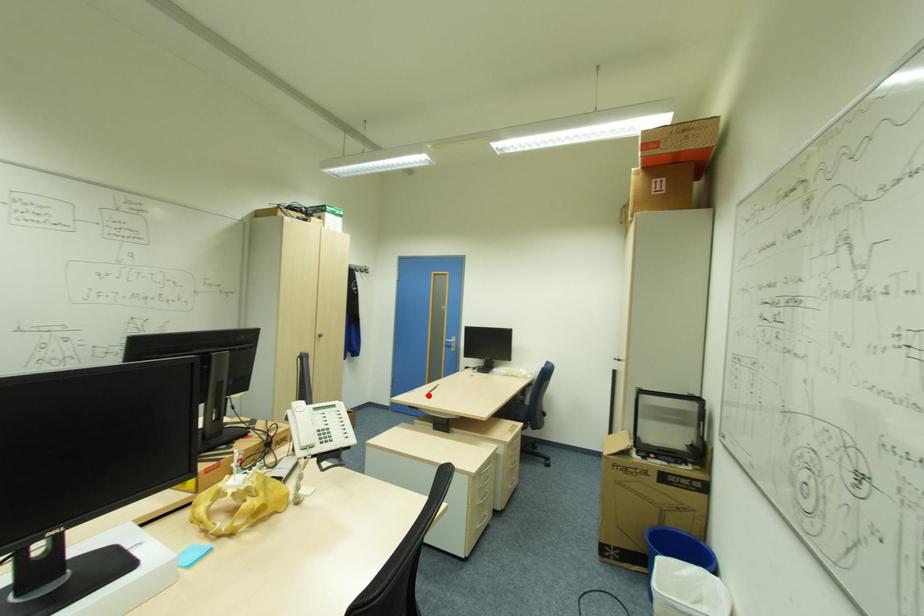
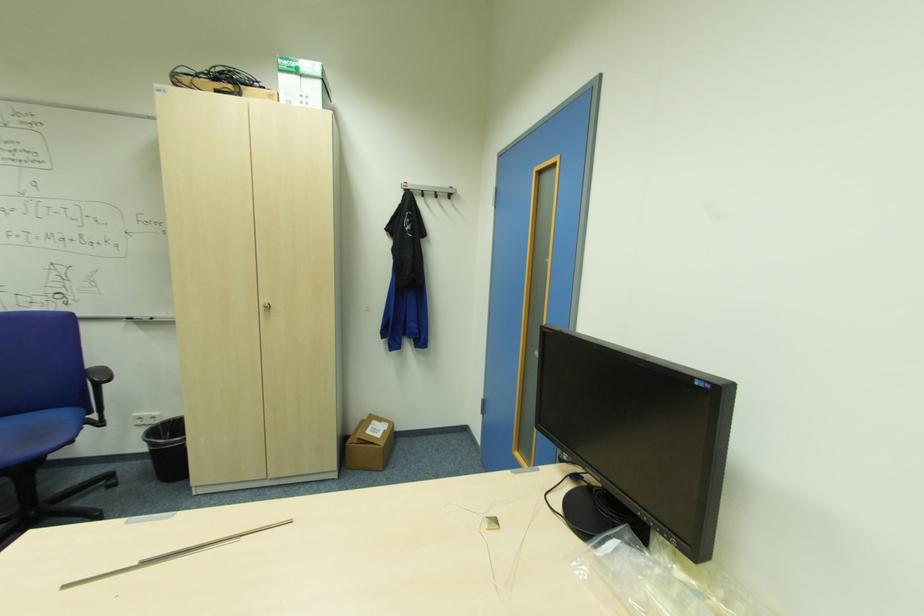
Where in the second image is the point corresponding to the highlighted location from the first image?

(63, 589)